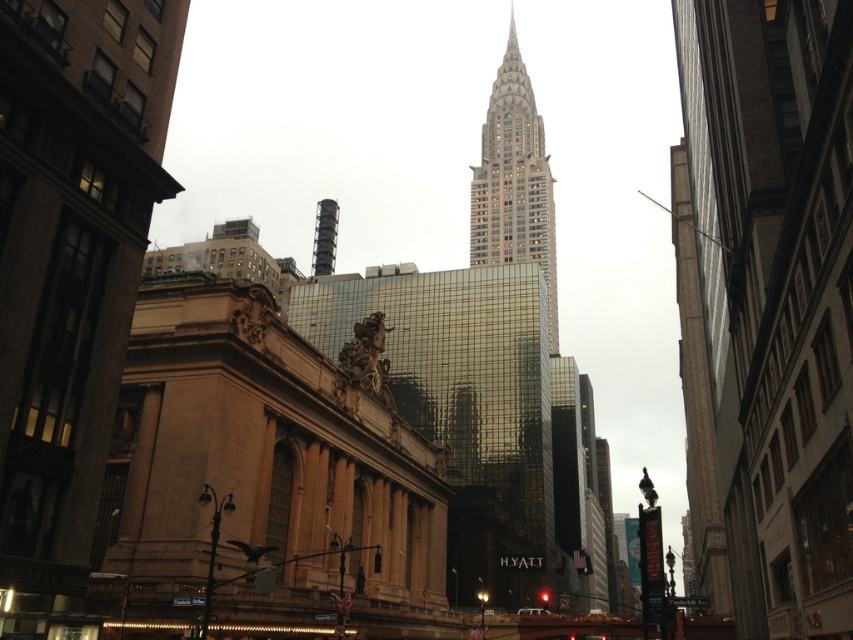
You are standing in the middle of the city square and see the gray stone tower at center and the black concrete chimney at center. Which one is closer to you?

The gray stone tower at center is closer to you since it is further to the viewer than the black concrete chimney at center.

In the scene shown: You are a drone operator tasked with flying a drone between the gray stone tower at center and the black concrete chimney at center. The drone has a maximum flight distance of 60 meters. Can the drone safely complete the flight between these two structures?

The distance between the gray stone tower at center and the black concrete chimney at center is 64.04 meters, which exceeds the drone maximum flight distance of 60 meters. Therefore, the drone cannot safely complete the flight between these two structures.

You are standing at the center of the image and want to locate the gray stone tower at center. According to the coordinates provided, in which direction should you look to find it?

The gray stone tower at center is located at coordinates point (514, 180). Since you are at the center, looking towards the lower left direction would align with the tower.